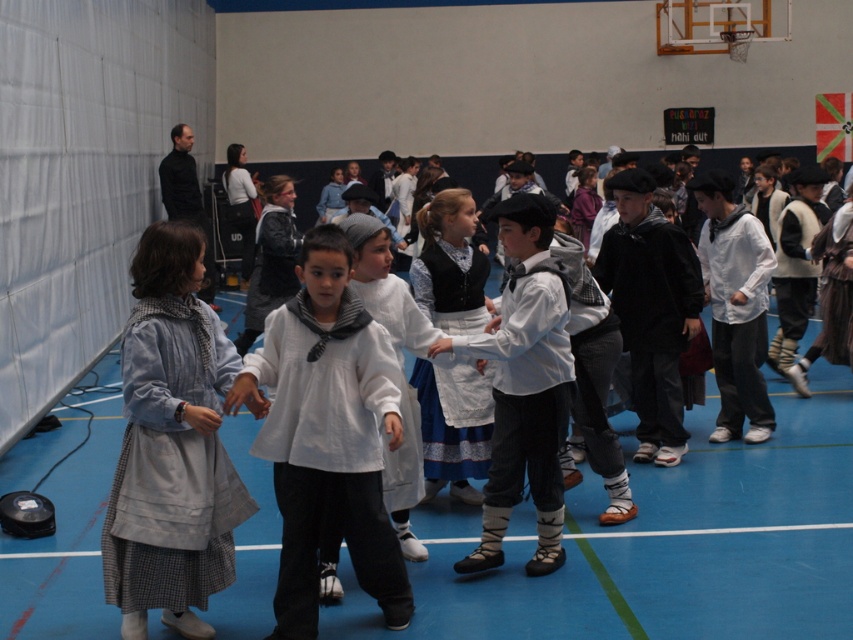
Can you confirm if white matte shirt at center is positioned to the right of white cotton shirt at center?

In fact, white matte shirt at center is to the left of white cotton shirt at center.

Can you confirm if white matte shirt at center is positioned to the left of white cotton shirt at center?

Correct, you'll find white matte shirt at center to the left of white cotton shirt at center.

Describe the element at coordinates (328, 433) in the screenshot. I see `white matte shirt at center` at that location.

You are a GUI agent. You are given a task and a screenshot of the screen. Output one action in this format:
    pyautogui.click(x=<x>, y=<y>)
    Task: Click on the white matte shirt at center
    
    Given the screenshot: What is the action you would take?
    pyautogui.click(x=328, y=433)

Locate an element on the screen. This screenshot has height=640, width=853. white matte shirt at center is located at coordinates coord(328,433).

Does white matte shirt at center have a lesser height compared to blue and white dress at center?

Incorrect, white matte shirt at center's height does not fall short of blue and white dress at center's.

Locate an element on the screen. white matte shirt at center is located at coordinates (328, 433).

Locate an element on the screen. This screenshot has height=640, width=853. white matte shirt at center is located at coordinates (328, 433).

Can you confirm if denim jacket at left is taller than blue and white dress at center?

Yes, denim jacket at left is taller than blue and white dress at center.

Image resolution: width=853 pixels, height=640 pixels. What do you see at coordinates (171, 445) in the screenshot?
I see `denim jacket at left` at bounding box center [171, 445].

Describe the element at coordinates (171, 445) in the screenshot. I see `denim jacket at left` at that location.

Where is `denim jacket at left`? denim jacket at left is located at coordinates (171, 445).